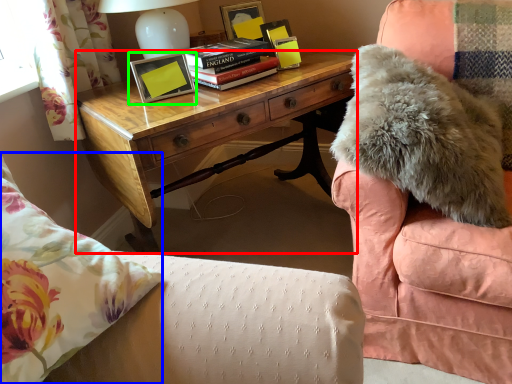
Question: Based on their relative distances, which object is nearer to desk (highlighted by a red box)? Choose from throw pillow (highlighted by a blue box) and picture frame (highlighted by a green box).

Choices:
 (A) throw pillow
 (B) picture frame

Answer: (B)